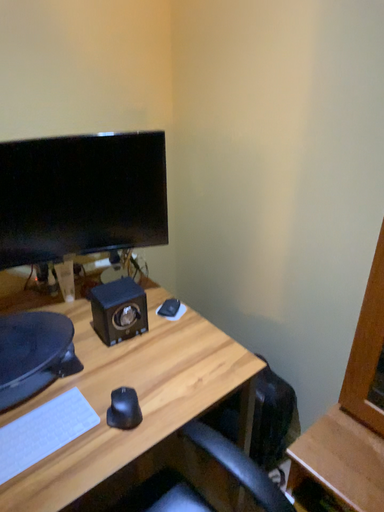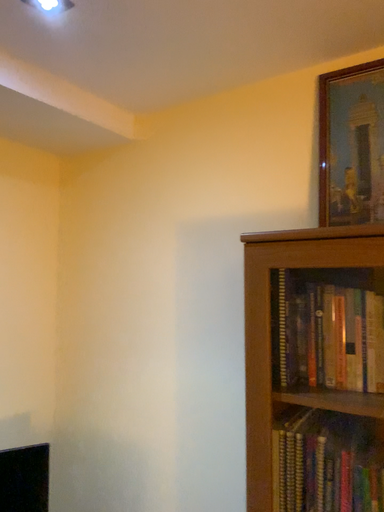
Question: Which way did the camera rotate in the video?

Choices:
 (A) rotated upward
 (B) rotated downward

Answer: (A)